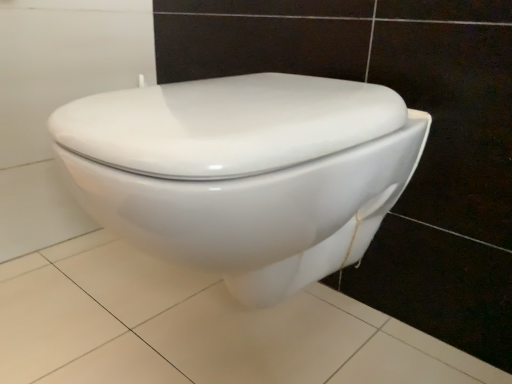
Find the location of `blank area to the left of white glossy toilet at center`. blank area to the left of white glossy toilet at center is located at coordinates (81, 293).